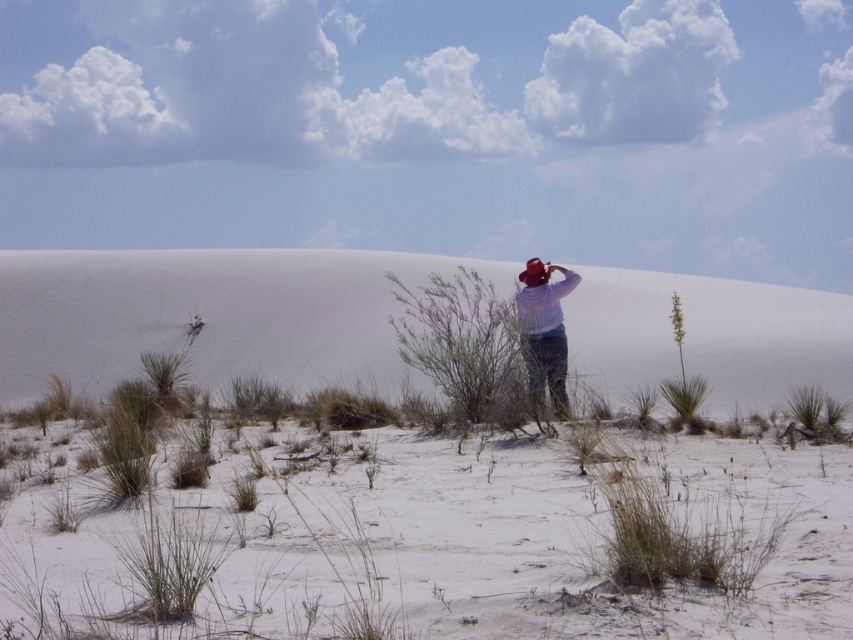
Can you confirm if white sandy at center is bigger than white sand dune at center?

No, white sandy at center is not bigger than white sand dune at center.

Is the position of white sandy at center more distant than that of white sand dune at center?

No, white sandy at center is closer to the viewer.

This screenshot has height=640, width=853. Find the location of `white sandy at center`. white sandy at center is located at coordinates (448, 547).

From the picture: Can you confirm if white sandy at center is shorter than green leafy bush at center?

Yes.

Can you confirm if white sandy at center is thinner than green leafy bush at center?

Yes, white sandy at center is thinner than green leafy bush at center.

Image resolution: width=853 pixels, height=640 pixels. I want to click on white sandy at center, so [x=448, y=547].

In the scene shown: Does white sandy at center have a lesser width compared to plaid shirt at center?

Correct, white sandy at center's width is less than plaid shirt at center's.

Is point (531, 445) positioned in front of point (527, 344)?

Yes, it is.

Where is `white sandy at center`? The image size is (853, 640). white sandy at center is located at coordinates [x=448, y=547].

You are a GUI agent. You are given a task and a screenshot of the screen. Output one action in this format:
    pyautogui.click(x=<x>, y=<y>)
    Task: Click on the white sandy at center
    Image resolution: width=853 pixels, height=640 pixels.
    Given the screenshot: What is the action you would take?
    pyautogui.click(x=448, y=547)